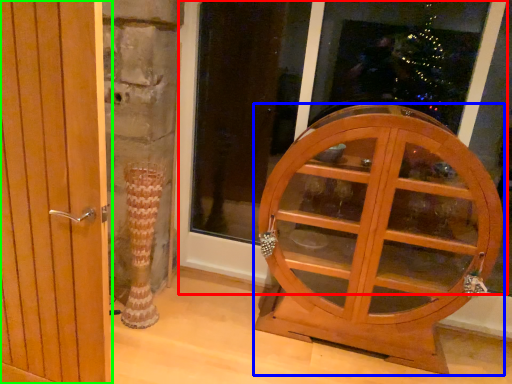
Question: Which object is positioned farthest from window frame (highlighted by a red box)? Select from furniture (highlighted by a blue box) and door (highlighted by a green box).

Choices:
 (A) furniture
 (B) door

Answer: (B)